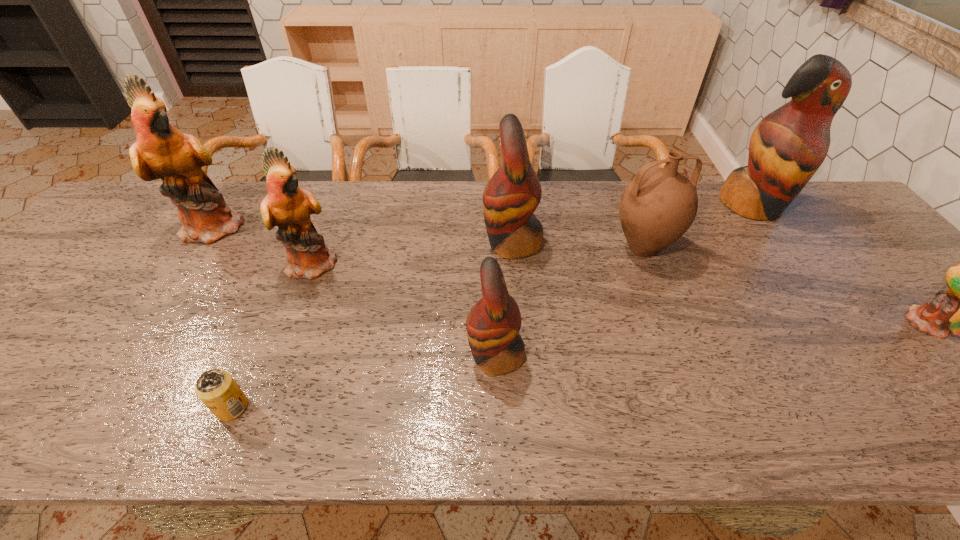
What are the coordinates of `free space between the second green parrot from right to left and the nearest red parrot` in the screenshot? It's located at (405, 309).

In order to click on vacant area that lies between the rightmost red parrot and the leftmost green parrot in this screenshot , I will do `click(484, 216)`.

At what (x,y) coordinates should I click in order to perform the action: click on free space between the biggest green parrot and the nearest red parrot. Please return your answer as a coordinate pair (x, y). Image resolution: width=960 pixels, height=540 pixels. Looking at the image, I should click on (356, 291).

Where is `free spot between the second biggest red parrot and the leftmost object`? free spot between the second biggest red parrot and the leftmost object is located at coordinates (365, 235).

You are a GUI agent. You are given a task and a screenshot of the screen. Output one action in this format:
    pyautogui.click(x=<x>, y=<y>)
    Task: Click on the empty location between the nearest red parrot and the second green parrot from right to left
    This screenshot has width=960, height=540.
    Given the screenshot: What is the action you would take?
    pyautogui.click(x=405, y=309)

This screenshot has width=960, height=540. Identify the location of vacant area between the leftmost object and the smallest red parrot. (356, 291).

Where is `vacant area between the second biggest green parrot and the beer can`? The image size is (960, 540). vacant area between the second biggest green parrot and the beer can is located at coordinates (273, 335).

At what (x,y) coordinates should I click in order to perform the action: click on the sixth closest object to the nearest green parrot. Please return your answer as a coordinate pair (x, y). This screenshot has height=540, width=960. Looking at the image, I should click on 217,389.

Point out which object is positioned as the seventh nearest to the second smallest green parrot. Please provide its 2D coordinates. Your answer should be formatted as a tuple, i.e. [(x, y)], where the tuple contains the x and y coordinates of a point satisfying the conditions above.

[(959, 310)]

Locate which parrot ranks second in proximity to the second biggest red parrot. Please provide its 2D coordinates. Your answer should be formatted as a tuple, i.e. [(x, y)], where the tuple contains the x and y coordinates of a point satisfying the conditions above.

[(287, 206)]